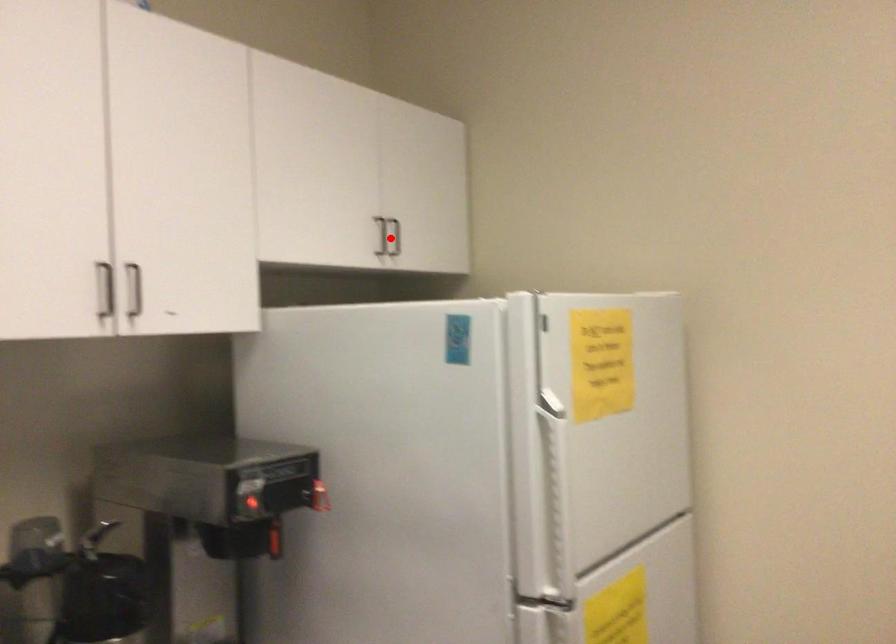
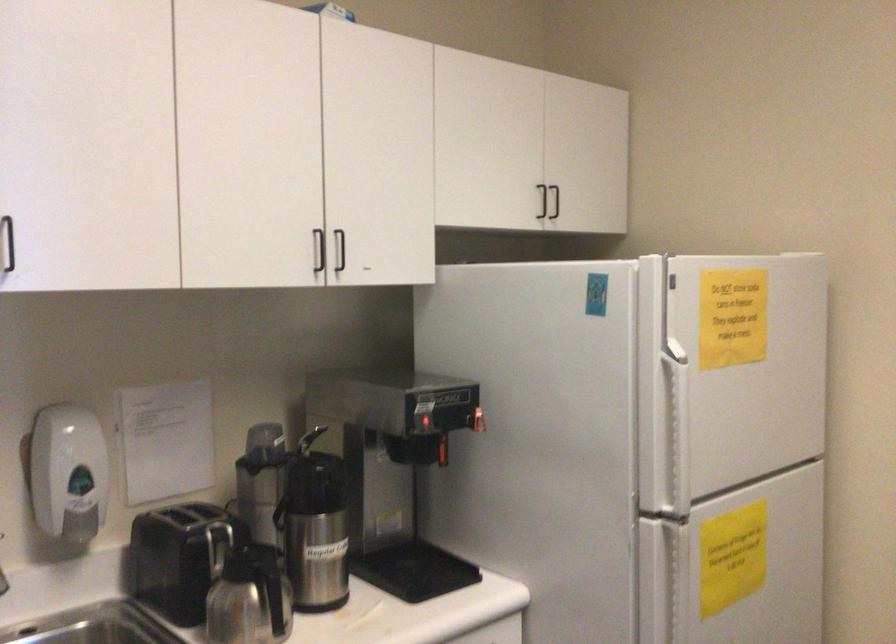
Locate, in the second image, the point that corresponds to the highlighted location in the first image.

(555, 201)